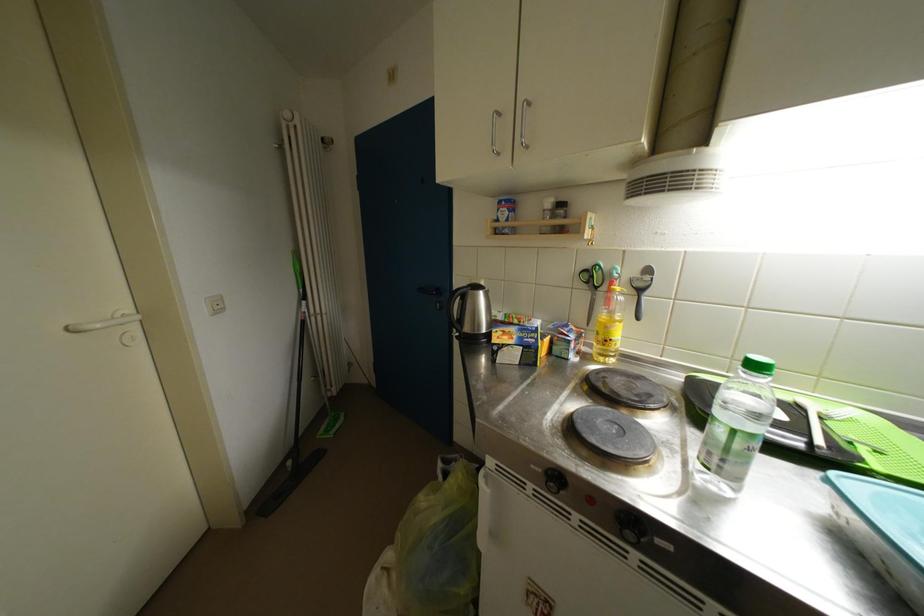
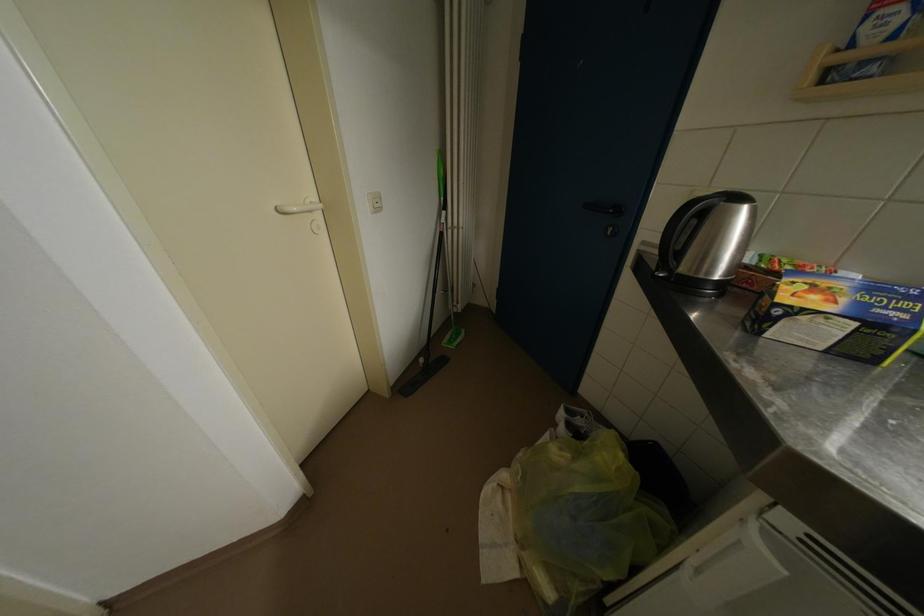
In the second image, find the point that corresponds to point 297,467 in the first image.

(429, 363)